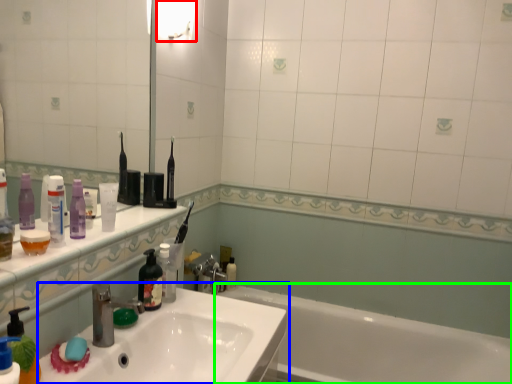
Question: Which object is the farthest from light fixture (highlighted by a red box)? Choose among these: sink (highlighted by a blue box) or bathtub (highlighted by a green box).

Choices:
 (A) sink
 (B) bathtub

Answer: (B)